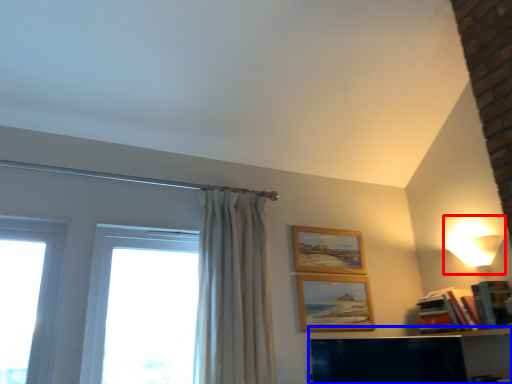
Question: Which object is closer to the camera taking this photo, lamp (highlighted by a red box) or shelf (highlighted by a blue box)?

Choices:
 (A) lamp
 (B) shelf

Answer: (B)